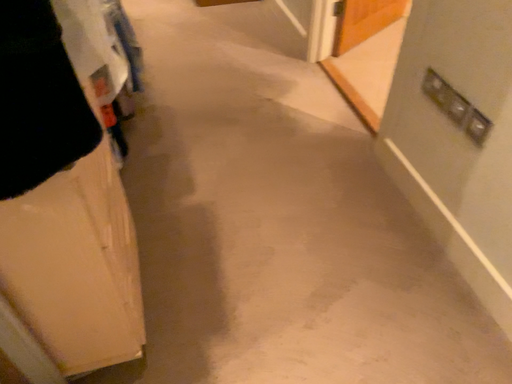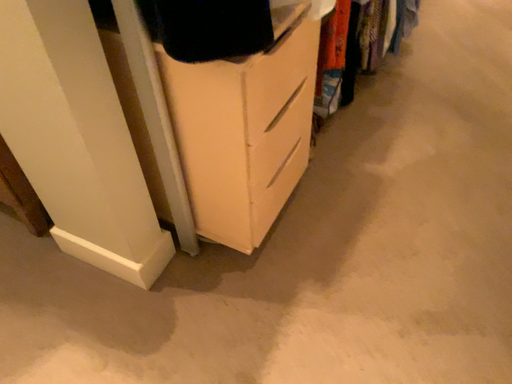
Question: Which way did the camera rotate in the video?

Choices:
 (A) rotated right
 (B) rotated left

Answer: (B)